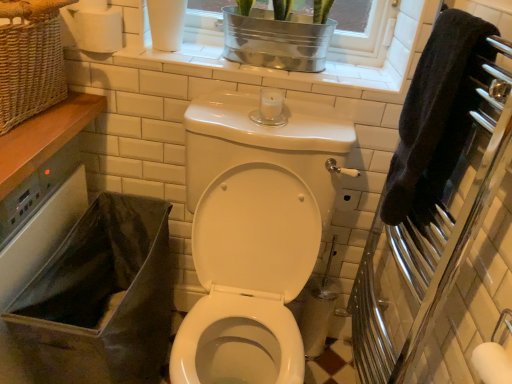
The height and width of the screenshot is (384, 512). I want to click on white matte toilet paper at upper left, so click(97, 26).

In order to click on woven wicker basket at upper left in this screenshot , I will do `click(30, 60)`.

In order to face woven wicker basket at upper left, should I rotate leftwards or rightwards?

Turn left approximately 29.757 degrees to face it.

The height and width of the screenshot is (384, 512). Find the location of `black fabric laundry basket at lower left`. black fabric laundry basket at lower left is located at coordinates (101, 298).

I want to click on black terry cloth towel at right, so click(x=437, y=114).

Locate an element on the screen. Image resolution: width=512 pixels, height=384 pixels. polished chrome towel rack at right is located at coordinates (430, 192).

I want to click on metallic silver window frame at upper center, marked as the second window frame in a left-to-right arrangement, so click(362, 38).

Locate an element on the screen. The height and width of the screenshot is (384, 512). white matte toilet paper at upper left is located at coordinates (97, 26).

Is black terry cloth towel at right in contact with black fabric laundry basket at lower left?

black terry cloth towel at right and black fabric laundry basket at lower left are not in contact.

Can you tell me how much black terry cloth towel at right and black fabric laundry basket at lower left differ in facing direction?

The angle between the facing direction of black terry cloth towel at right and the facing direction of black fabric laundry basket at lower left is 88.8 degrees.

Is black terry cloth towel at right inside or outside of black fabric laundry basket at lower left?

black terry cloth towel at right cannot be found inside black fabric laundry basket at lower left.

I want to click on laundry basket directly beneath the black terry cloth towel at right (from a real-world perspective), so click(x=101, y=298).

Considering their positions, is black fabric laundry basket at lower left located in front of or behind metallic silver window frame at upper center, arranged as the 1th window frame when viewed from the right?

black fabric laundry basket at lower left is in front of metallic silver window frame at upper center, arranged as the 1th window frame when viewed from the right.

Between black fabric laundry basket at lower left and metallic silver window frame at upper center, marked as the second window frame in a left-to-right arrangement, which one appears on the left side from the viewer's perspective?

black fabric laundry basket at lower left is more to the left.

Is black terry cloth towel at right at the back of woven wicker basket at upper left?

No.

Can black terry cloth towel at right be found inside woven wicker basket at upper left?

No, black terry cloth towel at right is located outside of woven wicker basket at upper left.

Considering the sizes of woven wicker basket at upper left and black terry cloth towel at right in the image, is woven wicker basket at upper left wider or thinner than black terry cloth towel at right?

Considering their sizes, woven wicker basket at upper left looks broader than black terry cloth towel at right.

From the image's perspective, which one is positioned lower, woven wicker basket at upper left or black terry cloth towel at right?

black terry cloth towel at right.

Considering the sizes of woven wicker basket at upper left and black fabric laundry basket at lower left in the image, is woven wicker basket at upper left wider or thinner than black fabric laundry basket at lower left?

Considering their sizes, woven wicker basket at upper left looks slimmer than black fabric laundry basket at lower left.

Is woven wicker basket at upper left positioned with its back to black fabric laundry basket at lower left?

woven wicker basket at upper left is not turned away from black fabric laundry basket at lower left.

Does woven wicker basket at upper left appear on the right side of black fabric laundry basket at lower left?

No, woven wicker basket at upper left is not to the right of black fabric laundry basket at lower left.

From a real-world perspective, is black fabric laundry basket at lower left over woven wicker basket at upper left?

No, from a real-world perspective, black fabric laundry basket at lower left is not over woven wicker basket at upper left

Is point (146, 243) positioned behind point (16, 14)?

Yes, point (146, 243) is farther from viewer.

From the image's perspective, between black fabric laundry basket at lower left and woven wicker basket at upper left, which one is located above?

woven wicker basket at upper left, from the image's perspective.

From the picture: Is black fabric laundry basket at lower left positioned with its back to woven wicker basket at upper left?

black fabric laundry basket at lower left does not have its back to woven wicker basket at upper left.

Is black terry cloth towel at right shorter than polished chrome towel rack at right?

Correct, black terry cloth towel at right is not as tall as polished chrome towel rack at right.

Find the location of `hand towel on the left of polished chrome towel rack at right`. hand towel on the left of polished chrome towel rack at right is located at coordinates (437, 114).

Is black terry cloth towel at right wider or thinner than polished chrome towel rack at right?

Considering their sizes, black terry cloth towel at right looks slimmer than polished chrome towel rack at right.

Is point (22, 76) positioned after point (130, 31)?

No, it is in front of (130, 31).

Between woven wicker basket at upper left and white tile window frame at upper center, the 2th window frame from the right, which one has more height?

woven wicker basket at upper left.

From the picture: Is woven wicker basket at upper left inside or outside of white tile window frame at upper center, the 2th window frame from the right?

woven wicker basket at upper left is outside white tile window frame at upper center, the 2th window frame from the right.

In terms of size, does woven wicker basket at upper left appear bigger or smaller than white tile window frame at upper center, the first window frame when ordered from left to right?

Clearly, woven wicker basket at upper left is larger in size than white tile window frame at upper center, the first window frame when ordered from left to right.

I want to click on hand towel in front of the black fabric laundry basket at lower left, so click(437, 114).

Identify the location of laundry basket that is under the metallic silver window frame at upper center, marked as the second window frame in a left-to-right arrangement (from a real-world perspective). The image size is (512, 384). (101, 298).

In the scene shown: Which object lies further to the anchor point metallic silver window frame at upper center, marked as the second window frame in a left-to-right arrangement, black terry cloth towel at right or white glossy toilet at center?

white glossy toilet at center.

Consider the image. Looking at the image, which one is located closer to black terry cloth towel at right, woven wicker basket at upper left or white glossy toilet at center?

Among the two, white glossy toilet at center is located nearer to black terry cloth towel at right.

From the image, which object appears to be nearer to black fabric laundry basket at lower left, white matte toilet paper at upper left or black terry cloth towel at right?

white matte toilet paper at upper left is positioned closer to the anchor black fabric laundry basket at lower left.

Considering their positions, is polished chrome towel rack at right positioned further to white matte toilet paper at upper left than black fabric laundry basket at lower left?

Based on the image, polished chrome towel rack at right appears to be further to white matte toilet paper at upper left.

When comparing their distances from white tile window frame at upper center, the first window frame when ordered from left to right, does black terry cloth towel at right or white glossy toilet at center seem closer?

Based on the image, black terry cloth towel at right appears to be nearer to white tile window frame at upper center, the first window frame when ordered from left to right.

Looking at the image, which one is located closer to white glossy toilet at center, polished chrome towel rack at right or black fabric laundry basket at lower left?

black fabric laundry basket at lower left is positioned closer to the anchor white glossy toilet at center.

When comparing their distances from metallic silver window frame at upper center, marked as the second window frame in a left-to-right arrangement, does polished chrome towel rack at right or white glossy toilet at center seem further?

polished chrome towel rack at right lies further to metallic silver window frame at upper center, marked as the second window frame in a left-to-right arrangement, than the other object.

Estimate the real-world distances between objects in this image. Which object is closer to white tile window frame at upper center, the first window frame when ordered from left to right, black terry cloth towel at right or polished chrome towel rack at right?

black terry cloth towel at right is closer to white tile window frame at upper center, the first window frame when ordered from left to right.

Find the location of a particular element. toilet located between black fabric laundry basket at lower left and black terry cloth towel at right in the left-right direction is located at coordinates (254, 234).

In order to click on laundry basket between woven wicker basket at upper left and polished chrome towel rack at right in this screenshot , I will do `click(101, 298)`.

Locate an element on the screen. toilet paper between metallic silver window frame at upper center, marked as the second window frame in a left-to-right arrangement, and black fabric laundry basket at lower left from top to bottom is located at coordinates (97, 26).

Find the location of a particular element. The image size is (512, 384). hand towel between white tile window frame at upper center, the first window frame when ordered from left to right, and black fabric laundry basket at lower left from top to bottom is located at coordinates (437, 114).